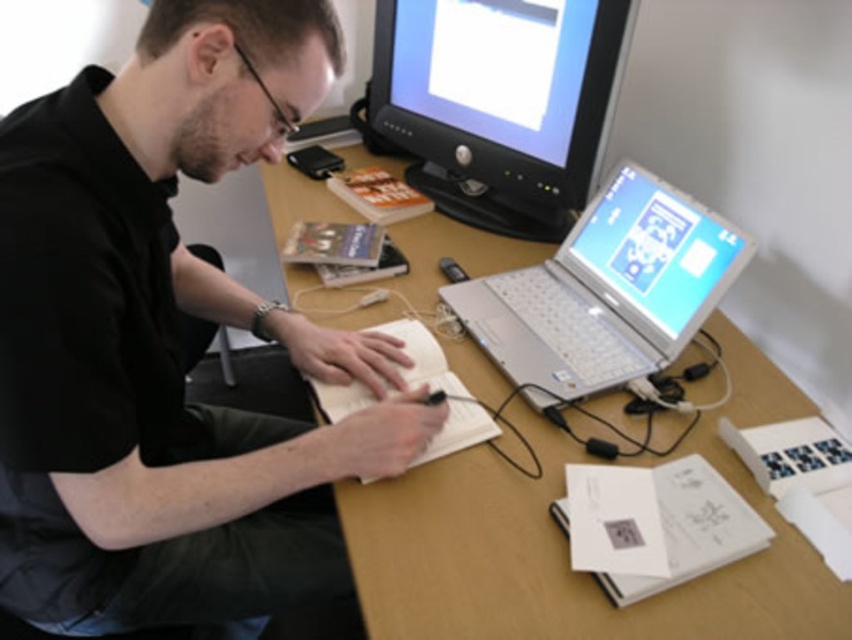
Question: Is black matte shirt at upper left thinner than wooden at center?

Choices:
 (A) yes
 (B) no

Answer: (A)

Question: Which of the following is the closest to the observer?

Choices:
 (A) (67, 268)
 (B) (534, 304)

Answer: (A)

Question: Which point is closer to the camera?

Choices:
 (A) (530, 320)
 (B) (580, 460)

Answer: (B)

Question: Can you confirm if black matte shirt at upper left is smaller than matte black monitor at upper center?

Choices:
 (A) yes
 (B) no

Answer: (B)

Question: Which point is closer to the camera?

Choices:
 (A) wooden at center
 (B) matte black monitor at upper center
 (C) black matte shirt at upper left
 (D) silver metallic laptop at center

Answer: (C)

Question: Does black matte shirt at upper left have a lesser width compared to wooden at center?

Choices:
 (A) no
 (B) yes

Answer: (B)